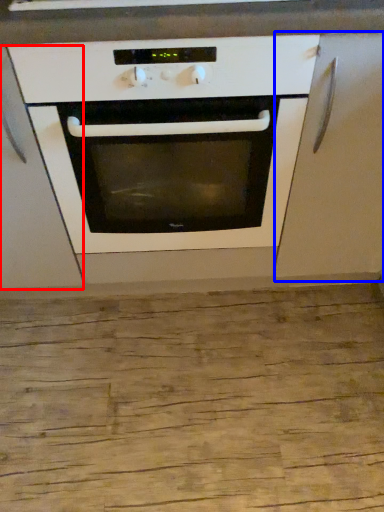
Question: Which object is closer to the camera taking this photo, cabinetry (highlighted by a red box) or cabinetry (highlighted by a blue box)?

Choices:
 (A) cabinetry
 (B) cabinetry

Answer: (A)